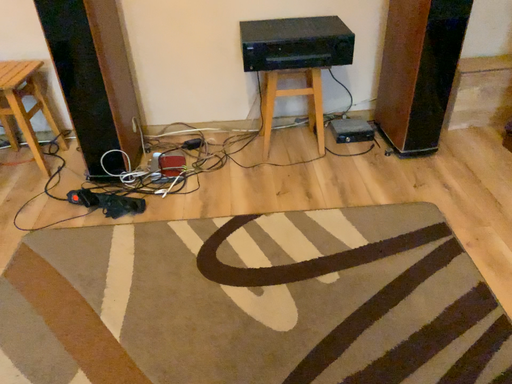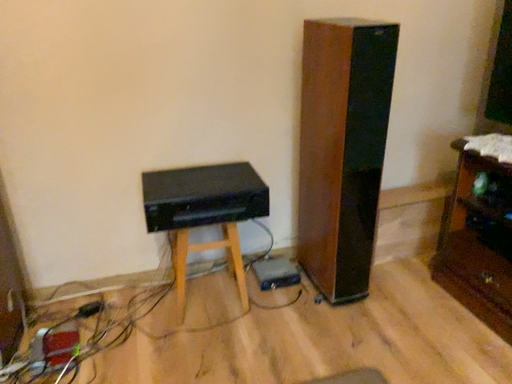
Question: Which way did the camera rotate in the video?

Choices:
 (A) rotated downward
 (B) rotated upward

Answer: (B)